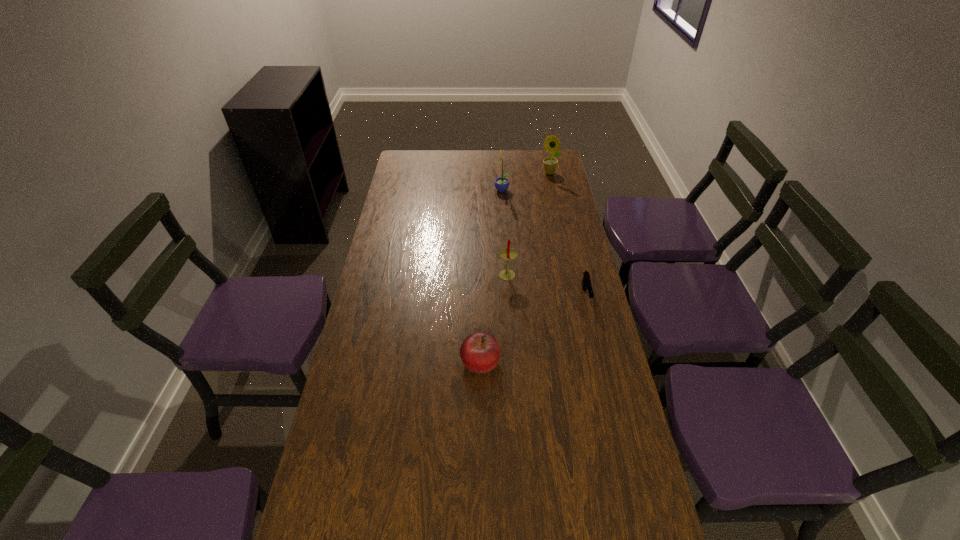
Choose which object is the second nearest neighbor to the second farthest object. Please provide its 2D coordinates. Your answer should be formatted as a tuple, i.e. [(x, y)], where the tuple contains the x and y coordinates of a point satisfying the conditions above.

[(509, 254)]

You are a GUI agent. You are given a task and a screenshot of the screen. Output one action in this format:
    pyautogui.click(x=<x>, y=<y>)
    Task: Click on the vacant point that satisfies the following two spatial constraints: 1. on the back side of the apple; 2. on the left side of the candle
    The image size is (960, 540).
    Given the screenshot: What is the action you would take?
    pos(480,276)